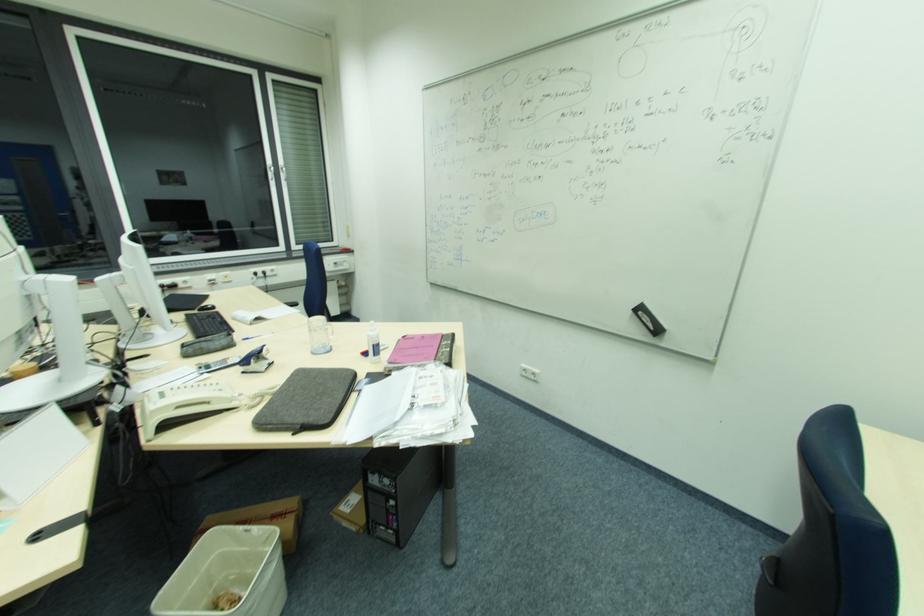
Describe the element at coordinates (207, 307) in the screenshot. I see `a black computer mouse` at that location.